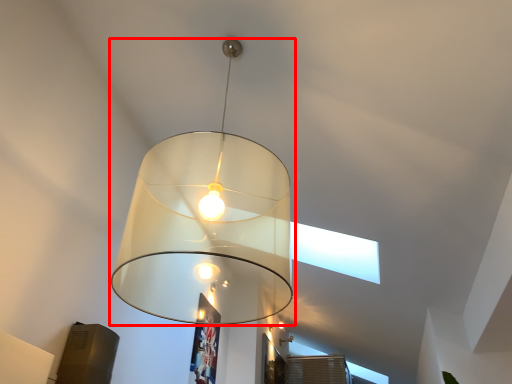
Question: From the image's perspective, what is the correct spatial positioning of lamp (annotated by the red box) in reference to lamp?

Choices:
 (A) above
 (B) below

Answer: (A)